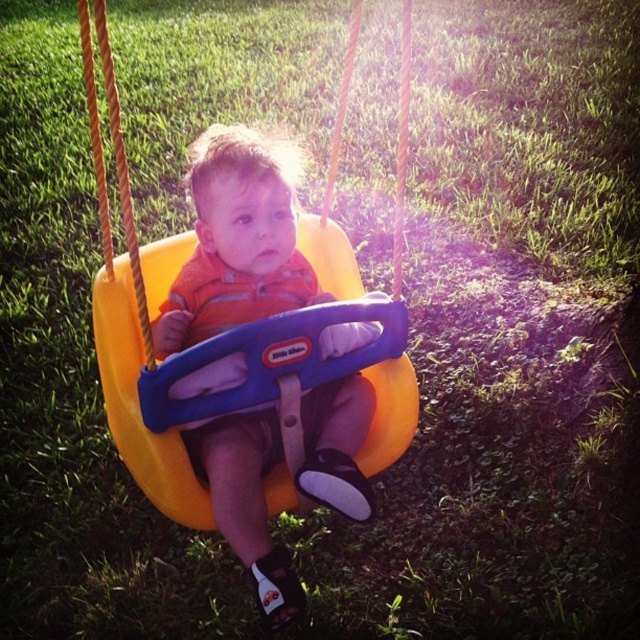
Measure the distance between yellow plastic swing at center and matte orange swing at center.

A distance of 12.30 inches exists between yellow plastic swing at center and matte orange swing at center.

Who is higher up, yellow plastic swing at center or matte orange swing at center?

matte orange swing at center

Between point (381, 445) and point (225, 442), which one is positioned in front?

Point (225, 442)

Locate an element on the screen. Image resolution: width=640 pixels, height=640 pixels. yellow plastic swing at center is located at coordinates (240, 328).